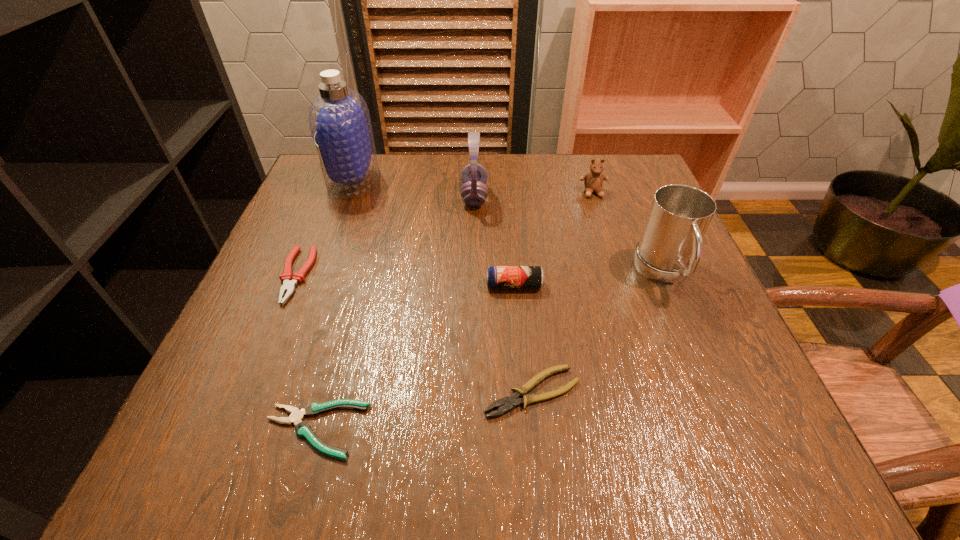
In the image, there is a desktop. Where is `vacant space at the near edge`? This screenshot has height=540, width=960. vacant space at the near edge is located at coordinates (574, 473).

I want to click on blank space at the left edge of the desktop, so click(275, 259).

In the image, there is a desktop. At what (x,y) coordinates should I click in order to perform the action: click on vacant space at the right edge. Please return your answer as a coordinate pair (x, y). This screenshot has height=540, width=960. Looking at the image, I should click on (637, 225).

In the image, there is a desktop. Where is `vacant space at the far right corner`? This screenshot has height=540, width=960. vacant space at the far right corner is located at coordinates (616, 161).

Locate an element on the screen. The width and height of the screenshot is (960, 540). free spot between the tallest pliers and the rightmost object is located at coordinates (480, 274).

Locate an element on the screen. vacant point located between the second shortest pliers and the second pliers from left to right is located at coordinates (423, 411).

This screenshot has height=540, width=960. Identify the location of vacant area that lies between the mug and the headset. (569, 234).

Find the location of a particular element. Image resolution: width=960 pixels, height=540 pixels. vacant area between the fourth shortest object and the second pliers from right to left is located at coordinates (415, 357).

Where is `vacant space that is in between the beer can and the rightmost pliers`? The height and width of the screenshot is (540, 960). vacant space that is in between the beer can and the rightmost pliers is located at coordinates (523, 339).

Locate an element on the screen. The height and width of the screenshot is (540, 960). unoccupied position between the cleansing agent and the farthest pliers is located at coordinates tap(324, 228).